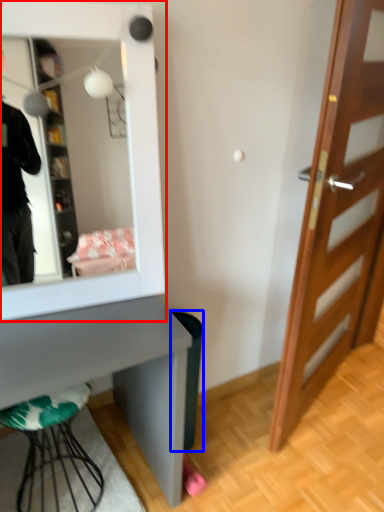
Question: Which object is further to the camera taking this photo, mirror (highlighted by a red box) or trash bin/can (highlighted by a blue box)?

Choices:
 (A) mirror
 (B) trash bin/can

Answer: (B)